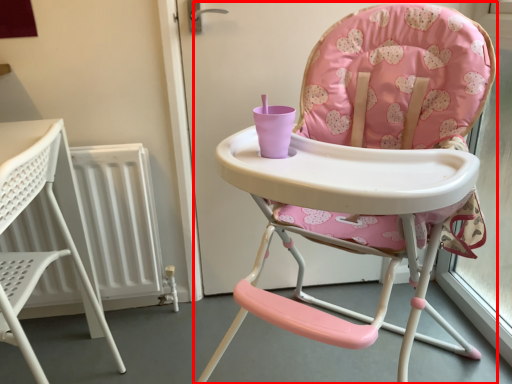
Question: From the image's perspective, what is the correct spatial positioning of chair (annotated by the red box) in reference to chair?

Choices:
 (A) above
 (B) below

Answer: (A)